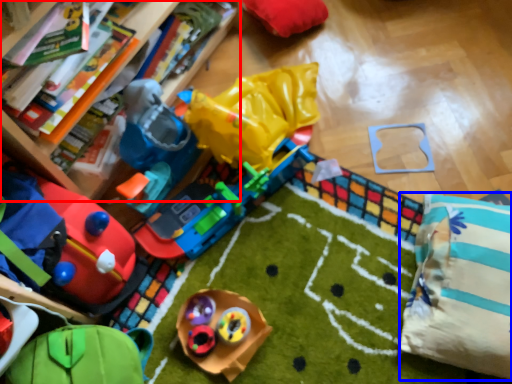
Question: Among these objects, which one is farthest to the camera, bookcase (highlighted by a red box) or pillow (highlighted by a blue box)?

Choices:
 (A) bookcase
 (B) pillow

Answer: (B)